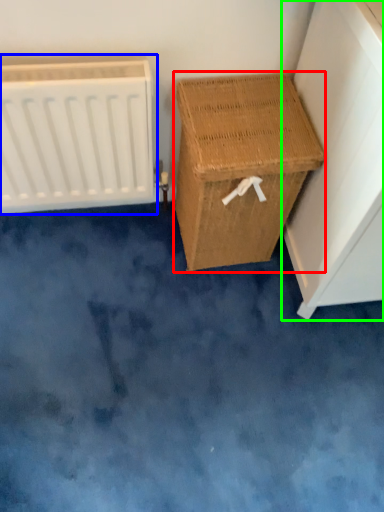
Question: Which object is positioned farthest from furniture (highlighted by a red box)? Select from radiator (highlighted by a blue box) and furniture (highlighted by a green box).

Choices:
 (A) radiator
 (B) furniture

Answer: (A)